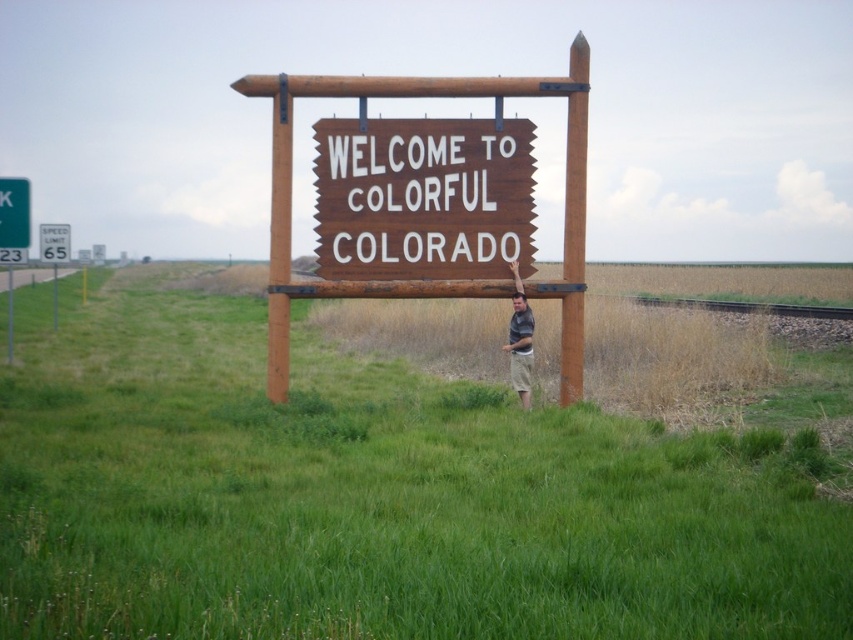
Question: Does brown wooden sign at center come behind matte gray shirt at center?

Choices:
 (A) yes
 (B) no

Answer: (A)

Question: Which of the following is the closest to the observer?

Choices:
 (A) brushed metal speed limit sign at left
 (B) green grassy field at center
 (C) brown wooden sign at center

Answer: (B)

Question: Which object is closer to the camera taking this photo?

Choices:
 (A) brushed metal speed limit sign at left
 (B) green grassy field at center
 (C) matte gray shirt at center

Answer: (B)

Question: Considering the real-world distances, which object is farthest from the brushed metal speed limit sign at left?

Choices:
 (A) brown wooden sign at center
 (B) green grassy field at center

Answer: (A)

Question: Can you confirm if green grassy field at center is positioned below brushed metal speed limit sign at left?

Choices:
 (A) yes
 (B) no

Answer: (A)

Question: Does brown wooden sign at center have a greater width compared to brushed metal speed limit sign at left?

Choices:
 (A) yes
 (B) no

Answer: (A)